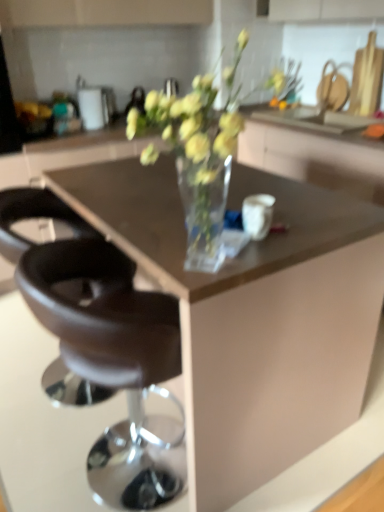
Question: Is black leather stool at lower left, which appears as the first chair when viewed from the back, wider or thinner than transparent glass cabinet at center?

Choices:
 (A) thin
 (B) wide

Answer: (A)

Question: Considering the positions of black leather stool at lower left, which appears as the first chair when viewed from the back, and transparent glass cabinet at center in the image, is black leather stool at lower left, which appears as the first chair when viewed from the back, bigger or smaller than transparent glass cabinet at center?

Choices:
 (A) small
 (B) big

Answer: (A)

Question: Which object is positioned farthest from the brown leather stool at center, the second chair in the back-to-front sequence?

Choices:
 (A) black leather stool at lower left, which appears as the first chair when viewed from the back
 (B) transparent glass cabinet at center

Answer: (B)

Question: Which object is positioned closest to the transparent glass cabinet at center?

Choices:
 (A) brown leather stool at center, the first chair positioned from the front
 (B) black leather stool at lower left, which appears as the first chair when viewed from the back

Answer: (B)